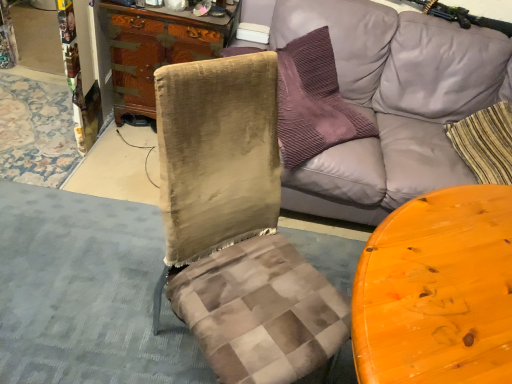
At what (x,y) coordinates should I click in order to perform the action: click on gray fabric couch at upper right. Please return your answer as a coordinate pair (x, y). The width and height of the screenshot is (512, 384). Looking at the image, I should click on (388, 101).

What do you see at coordinates (388, 101) in the screenshot? This screenshot has width=512, height=384. I see `gray fabric couch at upper right` at bounding box center [388, 101].

Image resolution: width=512 pixels, height=384 pixels. What do you see at coordinates (158, 49) in the screenshot? I see `wooden cabinet at center` at bounding box center [158, 49].

This screenshot has width=512, height=384. Find the location of `wooden cabinet at center`. wooden cabinet at center is located at coordinates (158, 49).

Locate an element on the screen. This screenshot has height=384, width=512. gray fabric couch at upper right is located at coordinates (388, 101).

Considering the positions of objects gray fabric couch at upper right and wooden cabinet at center in the image provided, who is more to the right, gray fabric couch at upper right or wooden cabinet at center?

gray fabric couch at upper right is more to the right.

In the scene shown: Between gray fabric couch at upper right and wooden cabinet at center, which one is positioned in front?

gray fabric couch at upper right is more forward.

Which point is more forward, (x=490, y=47) or (x=127, y=21)?

The point (x=127, y=21) is closer.

From the image's perspective, which is above, gray fabric couch at upper right or wooden cabinet at center?

From the image's view, wooden cabinet at center is above.

From a real-world perspective, between gray fabric couch at upper right and wooden cabinet at center, who is vertically lower?

In real-world perspective, wooden cabinet at center is lower.

Is gray fabric couch at upper right wider or thinner than wooden cabinet at center?

gray fabric couch at upper right is wider than wooden cabinet at center.

Considering the sizes of objects gray fabric couch at upper right and wooden cabinet at center in the image provided, who is taller, gray fabric couch at upper right or wooden cabinet at center?

With more height is gray fabric couch at upper right.

Can you confirm if gray fabric couch at upper right is smaller than wooden cabinet at center?

No, gray fabric couch at upper right is not smaller than wooden cabinet at center.

Is gray fabric couch at upper right positioned beyond the bounds of wooden cabinet at center?

Yes, gray fabric couch at upper right is located beyond the bounds of wooden cabinet at center.

Would you say gray fabric couch at upper right is a long distance from wooden cabinet at center?

No, gray fabric couch at upper right is in close proximity to wooden cabinet at center.

From the picture: Does gray fabric couch at upper right turn towards wooden cabinet at center?

No, gray fabric couch at upper right is not oriented towards wooden cabinet at center.

This screenshot has width=512, height=384. I want to click on studio couch in front of the wooden cabinet at center, so click(388, 101).

Which is more to the left, wooden cabinet at center or gray fabric couch at upper right?

wooden cabinet at center is more to the left.

Is the position of wooden cabinet at center more distant than that of gray fabric couch at upper right?

Yes, wooden cabinet at center is further from the viewer.

Which point is more forward, (127, 18) or (342, 40)?

Point (127, 18)

From the image's perspective, is wooden cabinet at center over gray fabric couch at upper right?

Yes, from the image's perspective, wooden cabinet at center is over gray fabric couch at upper right.

From a real-world perspective, who is located lower, wooden cabinet at center or gray fabric couch at upper right?

wooden cabinet at center is physically lower.

Is wooden cabinet at center thinner than gray fabric couch at upper right?

Yes, wooden cabinet at center is thinner than gray fabric couch at upper right.

In terms of height, does wooden cabinet at center look taller or shorter compared to gray fabric couch at upper right?

wooden cabinet at center is shorter than gray fabric couch at upper right.

In the scene shown: Between wooden cabinet at center and gray fabric couch at upper right, which one has larger size?

gray fabric couch at upper right.

Would you say wooden cabinet at center is inside or outside gray fabric couch at upper right?

wooden cabinet at center cannot be found inside gray fabric couch at upper right.

Is wooden cabinet at center positioned far away from gray fabric couch at upper right?

No, wooden cabinet at center is not far from gray fabric couch at upper right.

Is wooden cabinet at center aimed at gray fabric couch at upper right?

No, wooden cabinet at center is not turned towards gray fabric couch at upper right.

This screenshot has width=512, height=384. I want to click on studio couch located below the wooden cabinet at center (from the image's perspective), so click(388, 101).

Where is `studio couch below the wooden cabinet at center (from the image's perspective)`? studio couch below the wooden cabinet at center (from the image's perspective) is located at coordinates (388, 101).

In the image, there is a gray fabric couch at upper right. Identify the location of cabinetry below it (from a real-world perspective). (158, 49).